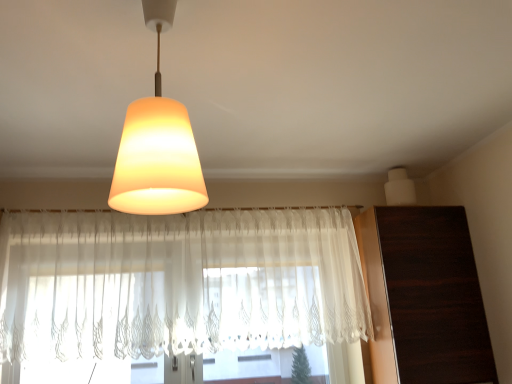
Question: Visually, is dark wood dresser at right positioned to the left or to the right of white matte speaker at upper right, acting as the 1th lamp starting from the right?

Choices:
 (A) right
 (B) left

Answer: (A)

Question: Relative to white matte speaker at upper right, the second lamp viewed from the left, is dark wood dresser at right in front or behind?

Choices:
 (A) front
 (B) behind

Answer: (A)

Question: Estimate the real-world distances between objects in this image. Which object is farther from the white sheer curtain at center?

Choices:
 (A) matte glass lampshade at upper center, marked as the second lamp in a right-to-left arrangement
 (B) dark wood dresser at right
 (C) white matte speaker at upper right, acting as the 1th lamp starting from the right

Answer: (A)

Question: Considering the real-world distances, which object is farthest from the white matte speaker at upper right, acting as the 1th lamp starting from the right?

Choices:
 (A) matte glass lampshade at upper center, marked as the second lamp in a right-to-left arrangement
 (B) white sheer curtain at center
 (C) dark wood dresser at right

Answer: (A)